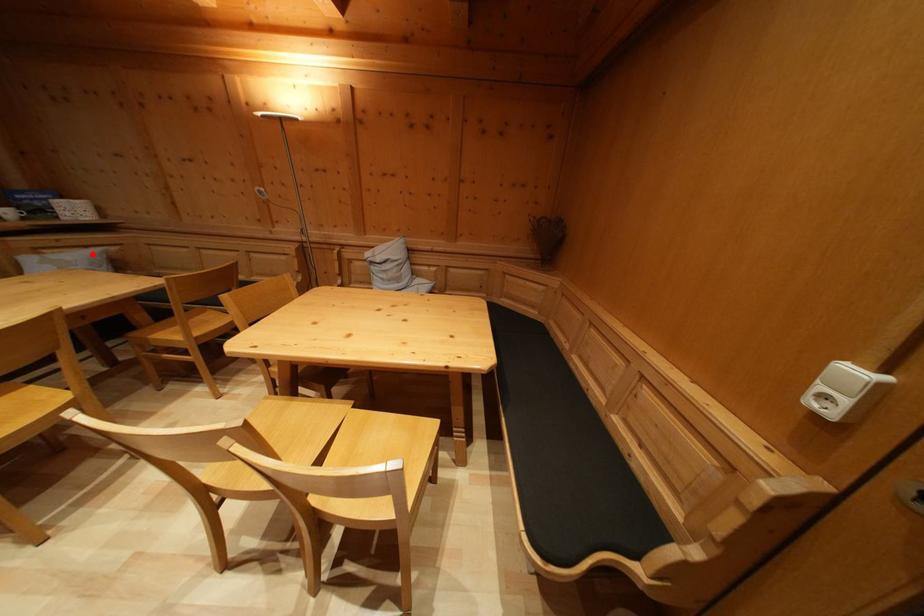
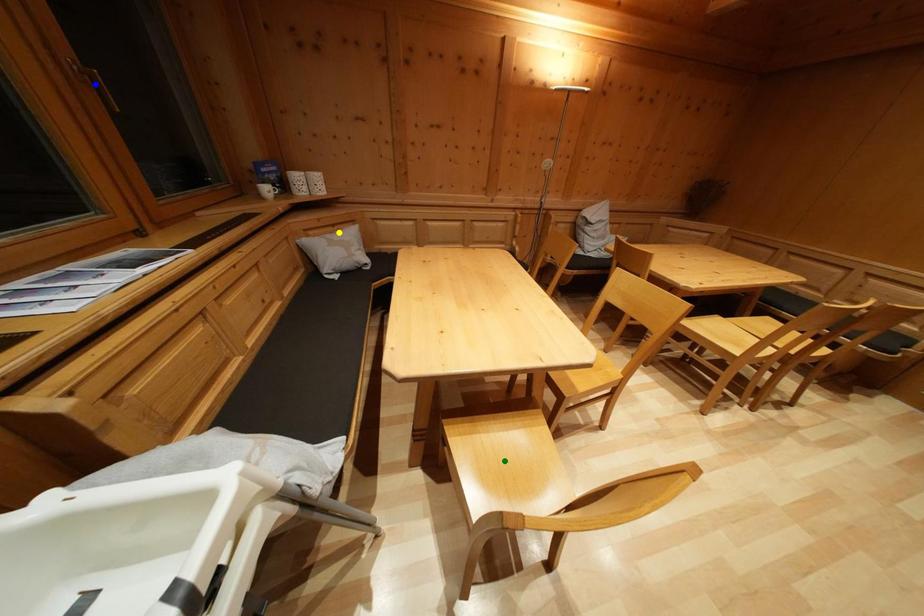
Question: I am providing you with two images of the same scene from different viewpoints. A red point is marked on the first image. You are given multiple points on the second image. Which point in image 2 is actually the same real-world point as the red point in image 1?

Choices:
 (A) blue point
 (B) green point
 (C) yellow point

Answer: (C)